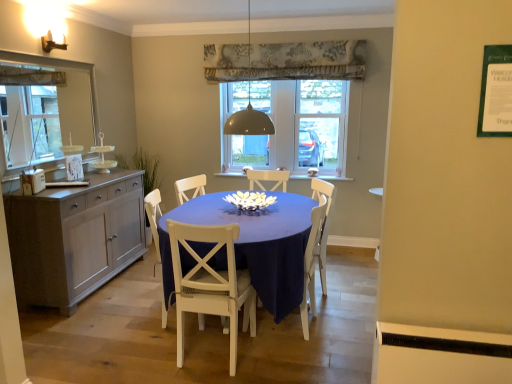
Identify the location of vacant point above clear glass door at center, which appears as the first glass door when viewed from the left (from a real-world perspective). (249, 83).